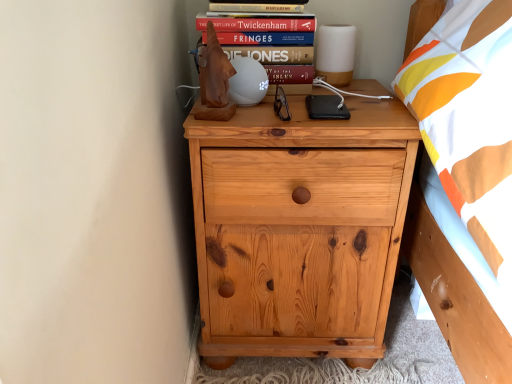
I want to click on blank space above natural wood chest of drawers at center (from a real-world perspective), so click(x=312, y=118).